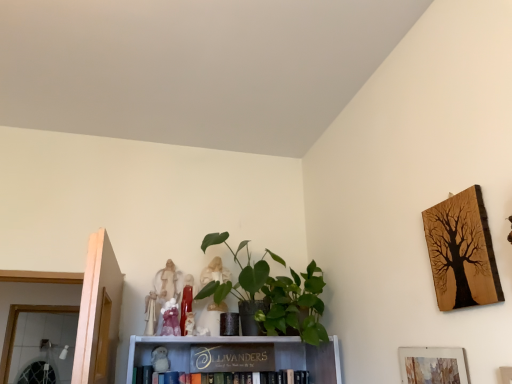
Question: Does white plush toy at center, the fifth toy from the right, appear on the right side of white fabric angel at upper center, arranged as the 1th toy when viewed from the left?

Choices:
 (A) yes
 (B) no

Answer: (A)

Question: Does white plush toy at center, the fifth toy from the right, lie in front of white fabric angel at upper center, which is the sixth toy in right-to-left order?

Choices:
 (A) no
 (B) yes

Answer: (A)

Question: From a real-world perspective, is white plush toy at center, the fifth toy from the right, beneath white fabric angel at upper center, arranged as the 1th toy when viewed from the left?

Choices:
 (A) no
 (B) yes

Answer: (B)

Question: Is white plush toy at center, positioned as the second toy in left-to-right order, bigger than white fabric angel at upper center, which is the sixth toy in right-to-left order?

Choices:
 (A) no
 (B) yes

Answer: (A)

Question: Considering the relative sizes of white plush toy at center, the fifth toy from the right, and white fabric angel at upper center, which is the sixth toy in right-to-left order, in the image provided, is white plush toy at center, the fifth toy from the right, shorter than white fabric angel at upper center, which is the sixth toy in right-to-left order,?

Choices:
 (A) yes
 (B) no

Answer: (A)

Question: Looking at the image, does matte pink porcelain at upper center, positioned as the 4th toy in right-to-left order, seem bigger or smaller compared to matte white figurine at center, which is the 3th toy in right-to-left order?

Choices:
 (A) big
 (B) small

Answer: (B)

Question: In terms of height, does matte pink porcelain at upper center, positioned as the 4th toy in right-to-left order, look taller or shorter compared to matte white figurine at center, which is the 3th toy in right-to-left order?

Choices:
 (A) short
 (B) tall

Answer: (A)

Question: Is matte pink porcelain at upper center, positioned as the 4th toy in right-to-left order, wider or thinner than matte white figurine at center, which appears as the fourth toy when viewed from the left?

Choices:
 (A) thin
 (B) wide

Answer: (A)

Question: From the image's perspective, is matte pink porcelain at upper center, marked as the third toy in a left-to-right arrangement, positioned above or below matte white figurine at center, which appears as the fourth toy when viewed from the left?

Choices:
 (A) above
 (B) below

Answer: (B)

Question: Relative to matte white figurine at center, placed as the 1th toy when sorted from right to left, is wooden sign at center, the first book positioned from the bottom, in front or behind?

Choices:
 (A) front
 (B) behind

Answer: (A)

Question: From the image's perspective, relative to matte white figurine at center, placed as the sixth toy when sorted from left to right, is wooden sign at center, the first book positioned from the bottom, above or below?

Choices:
 (A) above
 (B) below

Answer: (B)

Question: From a real-world perspective, relative to matte white figurine at center, placed as the 1th toy when sorted from right to left, is wooden sign at center, the first book positioned from the bottom, vertically above or below?

Choices:
 (A) above
 (B) below

Answer: (B)

Question: Looking at the image, does wooden sign at center, the first book positioned from the bottom, seem bigger or smaller compared to matte white figurine at center, placed as the sixth toy when sorted from left to right?

Choices:
 (A) big
 (B) small

Answer: (A)

Question: From the image's perspective, relative to matte white figurine at center, placed as the sixth toy when sorted from left to right, is watercolor paper picture frame at lower right, which ranks as the second picture frame in top-to-bottom order, above or below?

Choices:
 (A) below
 (B) above

Answer: (A)

Question: From a real-world perspective, is watercolor paper picture frame at lower right, the 1th picture frame ordered from the bottom, physically located above or below matte white figurine at center, placed as the 1th toy when sorted from right to left?

Choices:
 (A) below
 (B) above

Answer: (A)